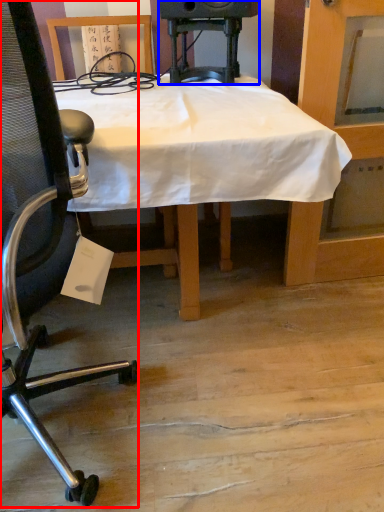
Question: Among these objects, which one is nearest to the camera, chair (highlighted by a red box) or speaker (highlighted by a blue box)?

Choices:
 (A) chair
 (B) speaker

Answer: (A)